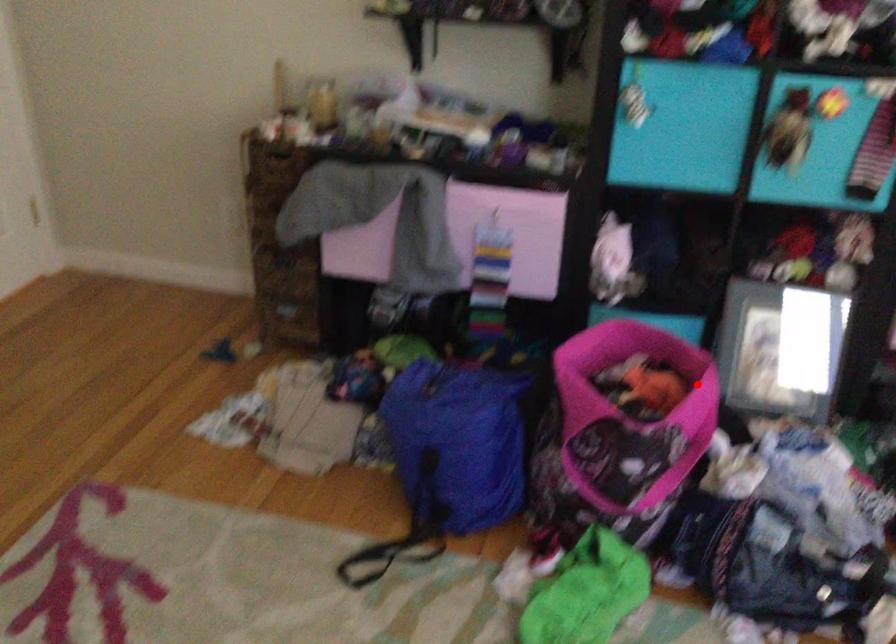
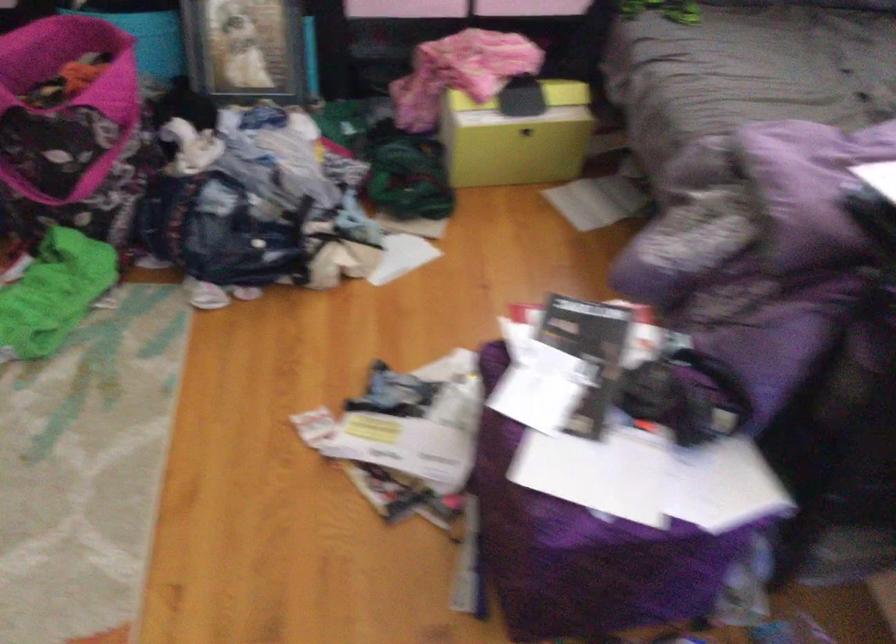
Where in the second image is the point corresponding to the highlighted location from the first image?

(124, 67)